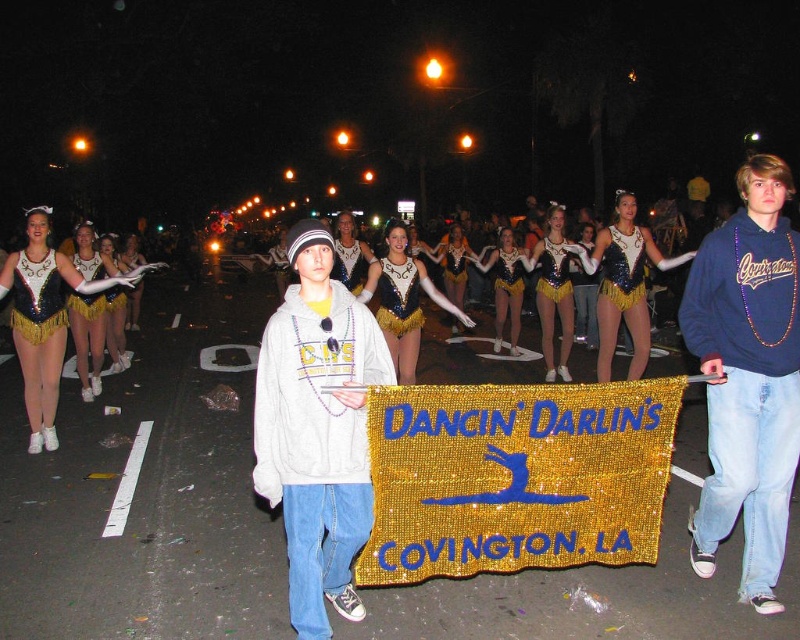
You are standing in the nighttime parade scene and want to know which of the two points, point 1 at coordinates point (608, 262) or point 2 at coordinates point (536, 289), is closer to you. Can you determine this based on the scene?

Point 1 at coordinates point (608, 262) is closer to the viewer than point 2 at coordinates point (536, 289).

You are a photographer at the parade and want to capture both the sequined gold leotard at left and the shiny sequined costume at center in a single shot. Which costume should you focus on to ensure both are visible in the frame?

The sequined gold leotard at left is bigger than the shiny sequined costume at center, so focusing on the sequined gold leotard at left will help ensure both are visible in the frame.